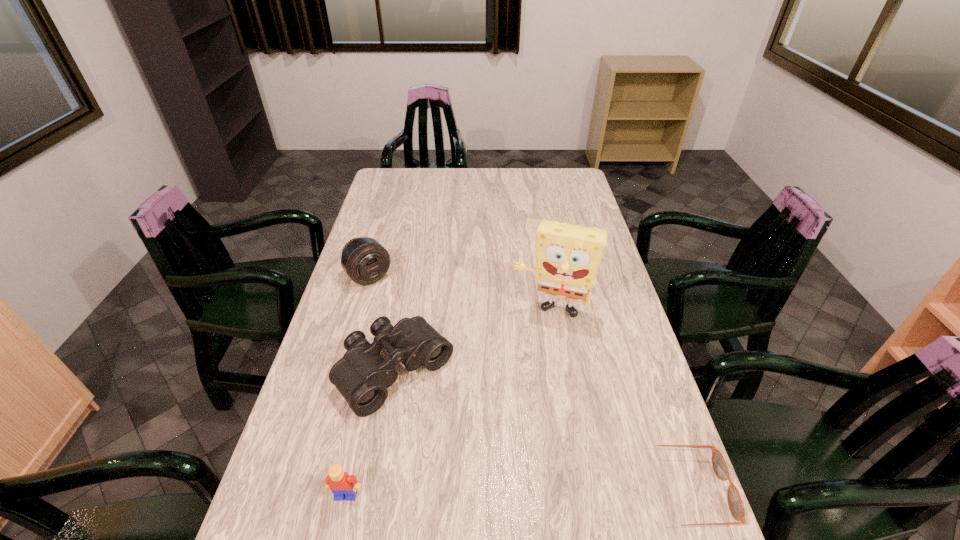
Image resolution: width=960 pixels, height=540 pixels. What are the coordinates of `vacant space located at the eyepieces of the third nearest object` in the screenshot? It's located at (521, 511).

I want to click on vacant space located 0.260m at the eyepieces of the third nearest object, so click(x=502, y=489).

Identify the location of vacant region located on the face of the sponge. The width and height of the screenshot is (960, 540). (521, 397).

You are a GUI agent. You are given a task and a screenshot of the screen. Output one action in this format:
    pyautogui.click(x=<x>, y=<y>)
    Task: Click on the blank space located on the face of the sponge
    The image size is (960, 540).
    Given the screenshot: What is the action you would take?
    pyautogui.click(x=527, y=376)

Identify the location of vacant position located 0.390m on the face of the sponge. The height and width of the screenshot is (540, 960). point(509,443).

Locate an element on the screen. The height and width of the screenshot is (540, 960). free point located on the front-facing side of the second tallest object is located at coordinates (391, 301).

Find the location of a particular element. The image size is (960, 540). free space located on the front-facing side of the second tallest object is located at coordinates (388, 298).

At what (x,y) coordinates should I click in order to perform the action: click on free region located 0.100m on the front-facing side of the second tallest object. Please return your answer as a coordinate pair (x, y). Looking at the image, I should click on 396,306.

This screenshot has width=960, height=540. I want to click on object present at the near edge, so click(736, 507).

The width and height of the screenshot is (960, 540). In order to click on Lego that is at the left edge in this screenshot , I will do `click(341, 484)`.